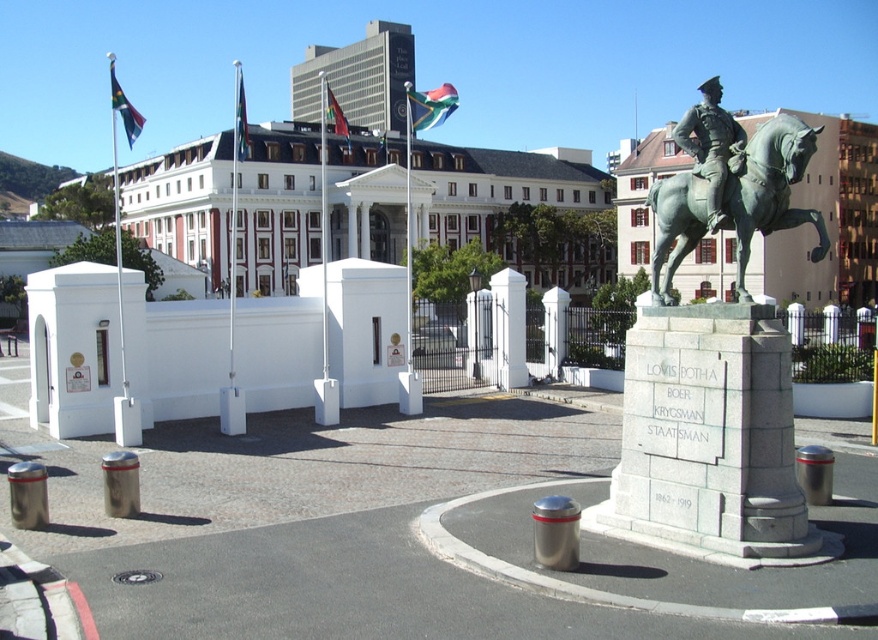
What do you see at coordinates (772, 188) in the screenshot?
I see `green patina bronze statue at center` at bounding box center [772, 188].

How far apart are green patina bronze statue at center and matte black flag at upper left?

They are 46.39 meters apart.

Between point (655, 232) and point (124, 113), which one is positioned behind?

Positioned behind is point (655, 232).

I want to click on green patina bronze statue at center, so click(x=772, y=188).

Is the position of bronze statue at center less distant than that of green fabric flag at center?

Yes, bronze statue at center is in front of green fabric flag at center.

Does bronze statue at center appear on the left side of green fabric flag at center?

No, bronze statue at center is not to the left of green fabric flag at center.

This screenshot has height=640, width=878. I want to click on bronze statue at center, so click(x=711, y=145).

Who is more forward, (815,330) or (667,209)?

Point (667,209) is in front.

Between point (545, 355) and point (761, 193), which one is positioned in front?

Point (761, 193) is more forward.

Where is `black wrought iron fence at center`? The width and height of the screenshot is (878, 640). black wrought iron fence at center is located at coordinates (830, 344).